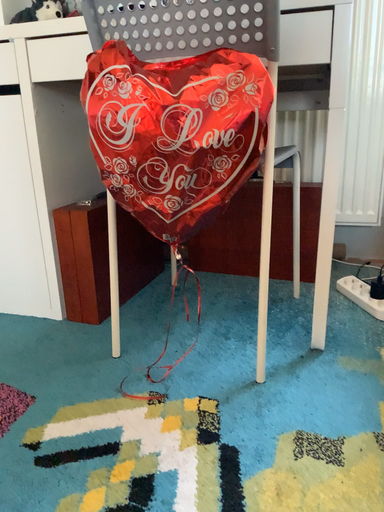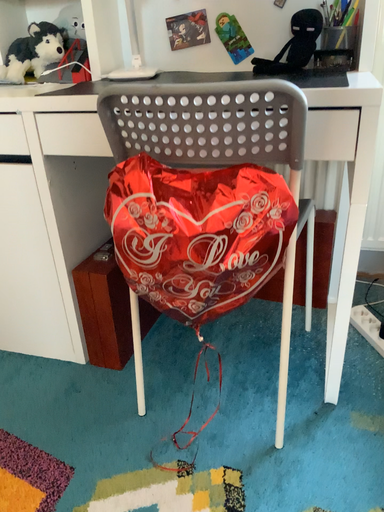
Question: How did the camera likely rotate when shooting the video?

Choices:
 (A) rotated upward
 (B) rotated downward

Answer: (B)